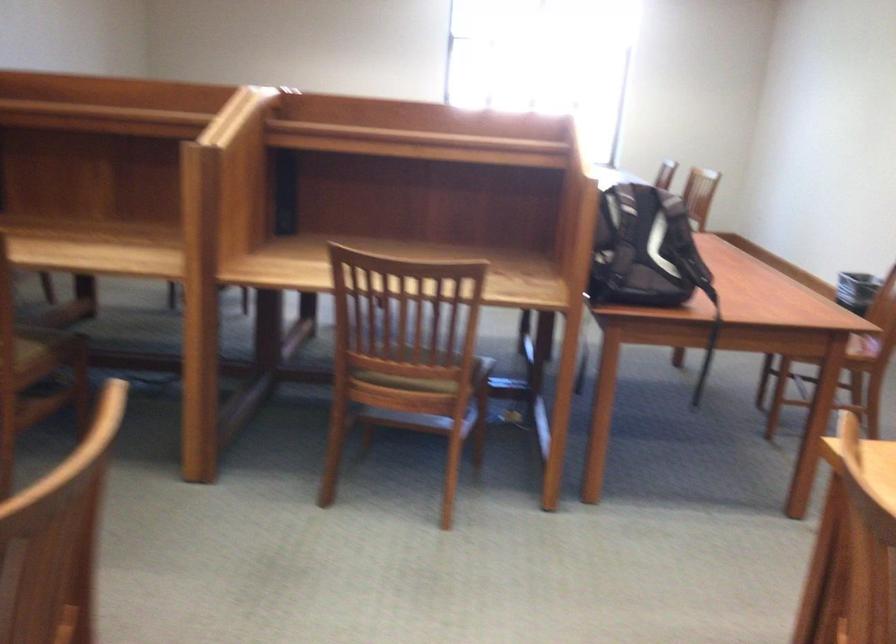
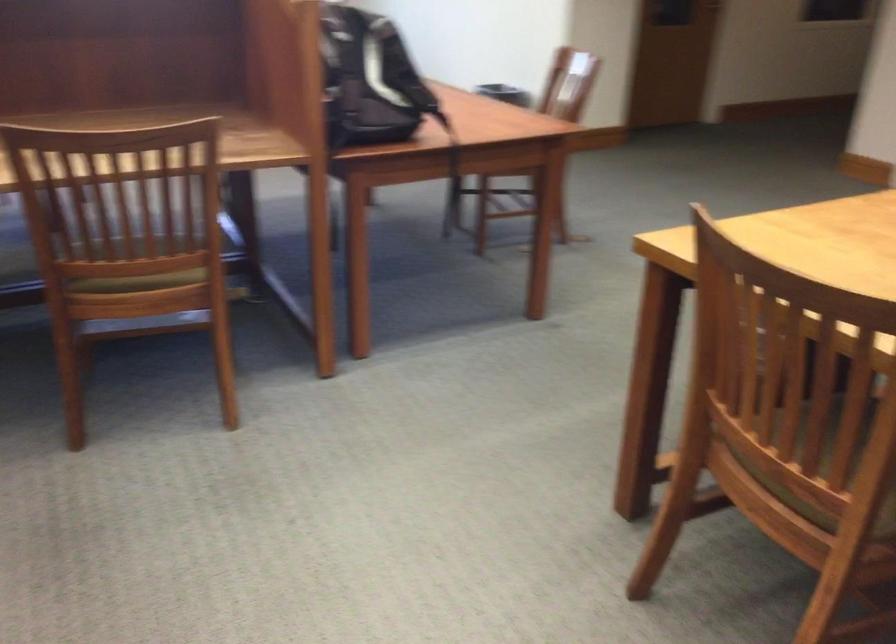
The point at (401, 368) is marked in the first image. Where is the corresponding point in the second image?

(139, 266)